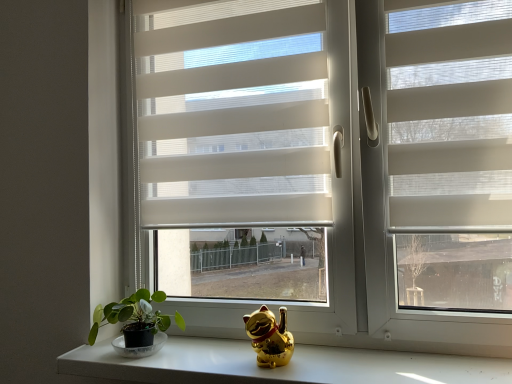
The image size is (512, 384). What do you see at coordinates (233, 114) in the screenshot?
I see `white textured blinds at center` at bounding box center [233, 114].

The width and height of the screenshot is (512, 384). I want to click on gold shiny cat at center, so click(x=269, y=337).

Image resolution: width=512 pixels, height=384 pixels. What do you see at coordinates (136, 323) in the screenshot? I see `green matte plant at lower left` at bounding box center [136, 323].

What do you see at coordinates (323, 144) in the screenshot?
I see `white matte window at center` at bounding box center [323, 144].

Image resolution: width=512 pixels, height=384 pixels. In order to click on gold metallic cat figurine at lower center in this screenshot , I will do `click(278, 368)`.

Where is `window located behind the white translucent screen door at right`? This screenshot has height=384, width=512. window located behind the white translucent screen door at right is located at coordinates (323, 144).

How different are the orientations of white matte window at center and white translucent screen door at right in degrees?

The angle between the facing direction of white matte window at center and the facing direction of white translucent screen door at right is 0.000277 degrees.

Can you confirm if white matte window at center is bigger than white translucent screen door at right?

Correct, white matte window at center is larger in size than white translucent screen door at right.

Is white matte window at center placed right next to white textured blinds at center?

Yes, white matte window at center is next to white textured blinds at center.

Is white matte window at center to the left of white textured blinds at center from the viewer's perspective?

No.

Does white matte window at center turn towards white textured blinds at center?

Yes.

In the scene shown: How many degrees apart are the facing directions of white matte window at center and white textured blinds at center?

The angle between the facing direction of white matte window at center and the facing direction of white textured blinds at center is 0.00299 degrees.

Considering the relative sizes of gold metallic cat figurine at lower center and white translucent screen door at right in the image provided, is gold metallic cat figurine at lower center wider than white translucent screen door at right?

Yes, gold metallic cat figurine at lower center is wider than white translucent screen door at right.

How many degrees apart are the facing directions of gold metallic cat figurine at lower center and white translucent screen door at right?

0.435 degrees.

Between gold metallic cat figurine at lower center and white translucent screen door at right, which one appears on the right side from the viewer's perspective?

Positioned to the right is white translucent screen door at right.

Do you think gold metallic cat figurine at lower center is within white translucent screen door at right, or outside of it?

gold metallic cat figurine at lower center exists outside the volume of white translucent screen door at right.

In terms of size, does gold metallic cat figurine at lower center appear bigger or smaller than white textured blinds at center?

Clearly, gold metallic cat figurine at lower center is smaller in size than white textured blinds at center.

Locate an element on the screen. The image size is (512, 384). window blind located behind the gold metallic cat figurine at lower center is located at coordinates (233, 114).

From a real-world perspective, is gold metallic cat figurine at lower center above or below white textured blinds at center?

Clearly, from a real-world perspective, gold metallic cat figurine at lower center is below white textured blinds at center.

Which is further, [250,352] or [277,89]?

The point [277,89] is farther.

Is point (158, 316) positioned after point (143, 367)?

Yes, it is behind point (143, 367).

In terms of size, does green matte plant at lower left appear bigger or smaller than gold metallic cat figurine at lower center?

Considering their sizes, green matte plant at lower left takes up less space than gold metallic cat figurine at lower center.

From the image's perspective, would you say green matte plant at lower left is shown under gold metallic cat figurine at lower center?

Actually, green matte plant at lower left appears above gold metallic cat figurine at lower center in the image.

Considering the sizes of green matte plant at lower left and gold metallic cat figurine at lower center in the image, is green matte plant at lower left taller or shorter than gold metallic cat figurine at lower center?

Clearly, green matte plant at lower left is taller compared to gold metallic cat figurine at lower center.

Between point (118, 308) and point (464, 53), which one is positioned in front?

Positioned in front is point (464, 53).

Between green matte plant at lower left and white translucent screen door at right, which one has larger size?

Bigger between the two is white translucent screen door at right.

From the image's perspective, is green matte plant at lower left located beneath white translucent screen door at right?

Indeed, from the image's perspective, green matte plant at lower left is shown beneath white translucent screen door at right.

What's the angular difference between white textured blinds at center and white matte window at center's facing directions?

They differ by 0.00299 degrees in their facing directions.

Where is `window blind that is behind the white matte window at center`? The width and height of the screenshot is (512, 384). window blind that is behind the white matte window at center is located at coordinates (233, 114).

Considering the relative sizes of white textured blinds at center and white matte window at center in the image provided, is white textured blinds at center bigger than white matte window at center?

No, white textured blinds at center is not bigger than white matte window at center.

Would you consider white textured blinds at center to be distant from white matte window at center?

No, white textured blinds at center is not far away from white matte window at center.

Identify the location of window below the white translucent screen door at right (from the image's perspective). The height and width of the screenshot is (384, 512). (323, 144).

I want to click on window blind positioned vertically above the white matte window at center (from a real-world perspective), so click(x=233, y=114).

Based on their spatial positions, is white matte window at center or gold shiny cat at center closer to green matte plant at lower left?

Among the two, gold shiny cat at center is located nearer to green matte plant at lower left.

Estimate the real-world distances between objects in this image. Which object is closer to white translucent screen door at right, gold shiny cat at center or gold metallic cat figurine at lower center?

The object closer to white translucent screen door at right is gold metallic cat figurine at lower center.

Looking at the image, which one is located further to green matte plant at lower left, gold metallic cat figurine at lower center or white translucent screen door at right?

white translucent screen door at right.

Based on their spatial positions, is green matte plant at lower left or gold shiny cat at center closer to gold metallic cat figurine at lower center?

Among the two, gold shiny cat at center is located nearer to gold metallic cat figurine at lower center.

Based on the photo, which object lies nearer to the anchor point gold metallic cat figurine at lower center, white matte window at center or white textured blinds at center?

white matte window at center lies closer to gold metallic cat figurine at lower center than the other object.

Looking at the image, which one is located closer to gold metallic cat figurine at lower center, white matte window at center or white translucent screen door at right?

white translucent screen door at right is closer to gold metallic cat figurine at lower center.

From the image, which object appears to be nearer to white matte window at center, gold shiny cat at center or gold metallic cat figurine at lower center?

The object closer to white matte window at center is gold metallic cat figurine at lower center.

Considering their positions, is gold metallic cat figurine at lower center positioned further to gold shiny cat at center than green matte plant at lower left?

green matte plant at lower left is further to gold shiny cat at center.

The width and height of the screenshot is (512, 384). In order to click on figurine between white matte window at center and gold metallic cat figurine at lower center in the vertical direction in this screenshot , I will do `click(269, 337)`.

Locate an element on the screen. The height and width of the screenshot is (384, 512). houseplant between white textured blinds at center and gold shiny cat at center in the up-down direction is located at coordinates (136, 323).

Find the location of `window between white textured blinds at center and gold metallic cat figurine at lower center in the vertical direction`. window between white textured blinds at center and gold metallic cat figurine at lower center in the vertical direction is located at coordinates (323, 144).

Where is `houseplant between white matte window at center and gold shiny cat at center in the up-down direction`? houseplant between white matte window at center and gold shiny cat at center in the up-down direction is located at coordinates (136, 323).